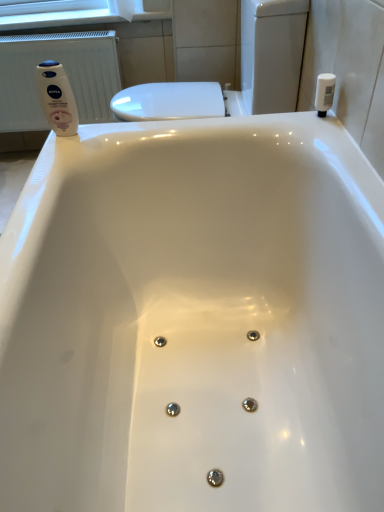
Question: Is point (139, 10) closer or farther from the camera than point (82, 34)?

Choices:
 (A) farther
 (B) closer

Answer: (A)

Question: Is white matte toilet paper at upper left spatially inside white plastic radiator at left, or outside of it?

Choices:
 (A) outside
 (B) inside

Answer: (A)

Question: Which object is positioned closest to the white matte lotion at upper left, which ranks as the 1th toiletry in left-to-right order?

Choices:
 (A) white matte toilet paper at upper left
 (B) white plastic radiator at left
 (C) white plastic bottle at upper right, which appears as the 2th toiletry when viewed from the left

Answer: (C)

Question: Based on their relative distances, which object is nearer to the white plastic bottle at upper right, marked as the first toiletry in a right-to-left arrangement?

Choices:
 (A) white matte toilet paper at upper left
 (B) white matte lotion at upper left, the second toiletry when ordered from right to left
 (C) white plastic radiator at left

Answer: (B)